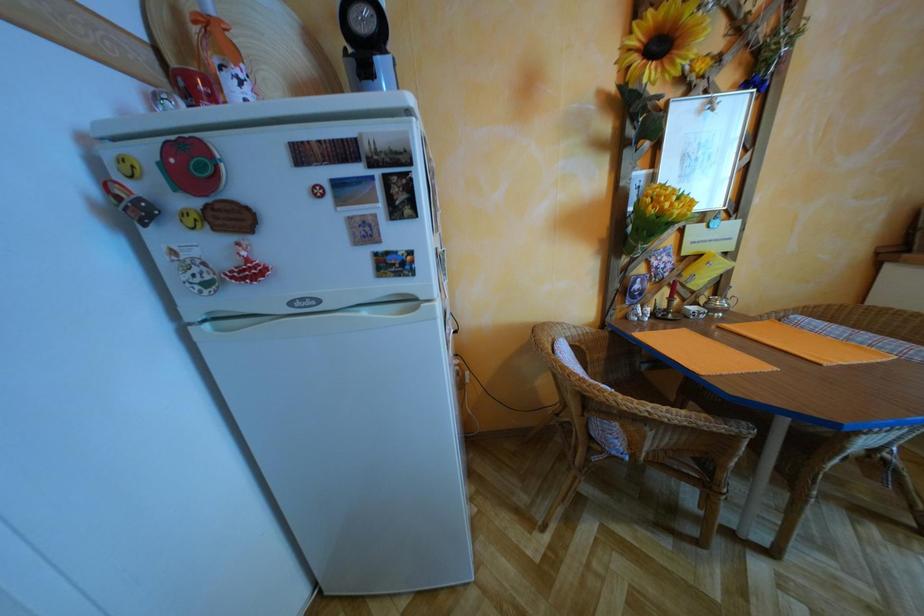
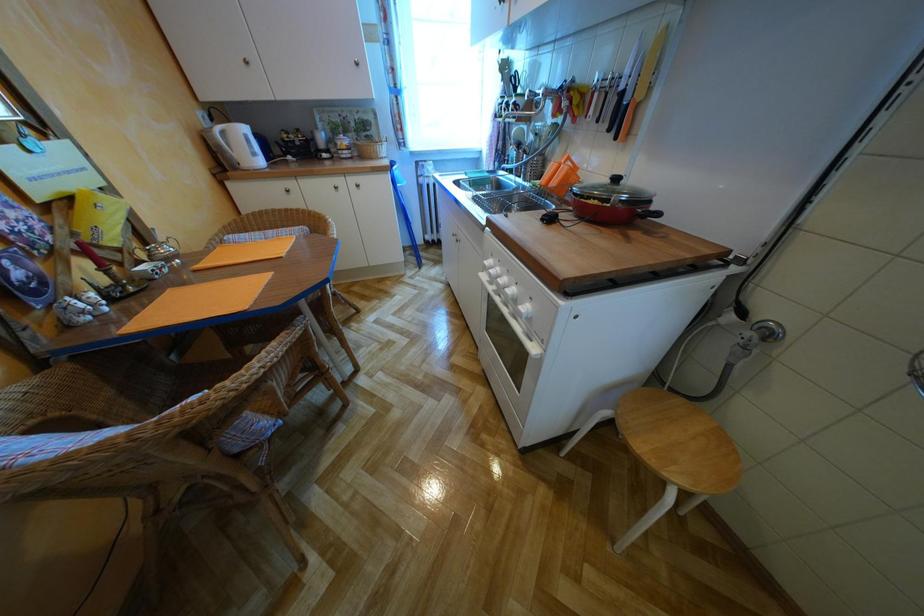
The first image is from the beginning of the video and the second image is from the end. How did the camera likely rotate when shooting the video?

The camera's rotation is toward right-down.